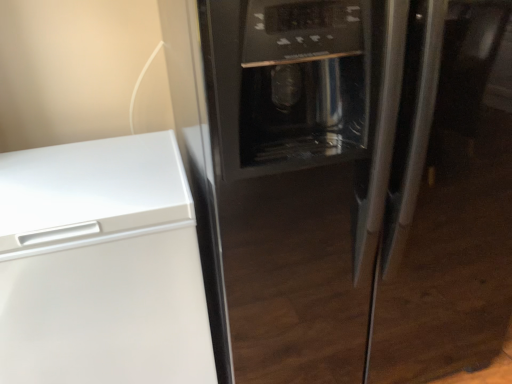
At what (x,y) coordinates should I click in order to perform the action: click on empty space that is ontop of white matte freezer at left (from a real-world perspective). Please return your answer as a coordinate pair (x, y). The width and height of the screenshot is (512, 384). Looking at the image, I should click on (92, 188).